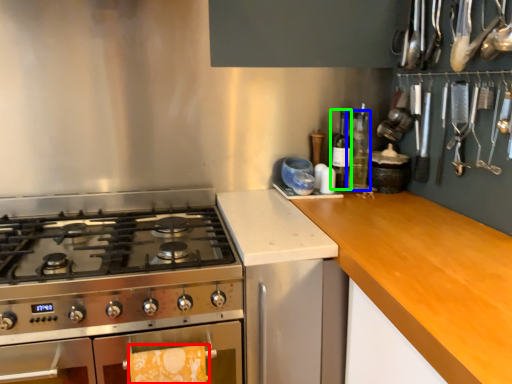
Question: Which is farther away from hand towel (highlighted by a red box)? bottle (highlighted by a blue box) or bottle (highlighted by a green box)?

Choices:
 (A) bottle
 (B) bottle

Answer: (A)